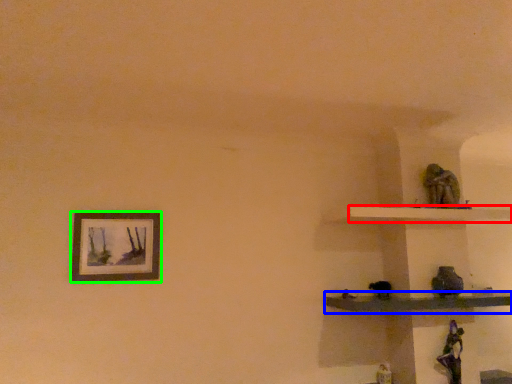
Question: Estimate the real-world distances between objects in this image. Which object is farther from shelf (highlighted by a red box), shelf (highlighted by a blue box) or picture frame (highlighted by a green box)?

Choices:
 (A) shelf
 (B) picture frame

Answer: (B)